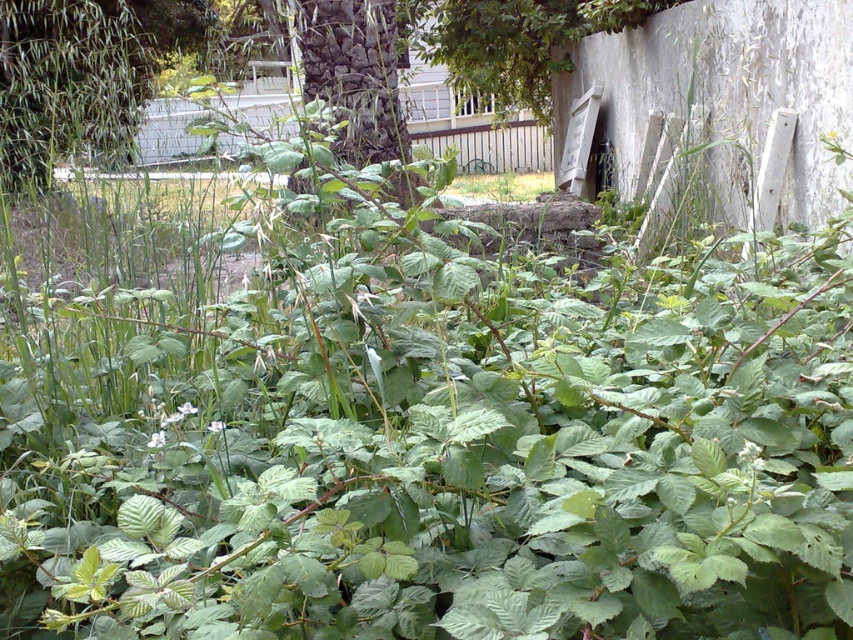
You are a gardener trying to clear a path through the garden. You need to decide which area to tackle first between the dark brown textured tree trunk at center and the green leafy grass at center. Based on their spatial presence, which one should you prioritize?

The dark brown textured tree trunk at center occupies less space than the green leafy grass at center, so you should prioritize clearing the green leafy grass at center first since it takes up more area and might be more obstructive.

You are standing in the garden and want to find the dark brown textured tree trunk at center. Based on the coordinates provided, where should you look relative to the point marked by point (352, 74)?

The point (352, 74) marks the exact location of the dark brown textured tree trunk at center, so you should look directly at that point to find it.

You are a gardener trying to clear a path through the garden. You see the dark brown textured tree trunk at center and the green leafy grass at center. Which object is closer to the ground?

The dark brown textured tree trunk at center is positioned under the green leafy grass at center, so it is closer to the ground.